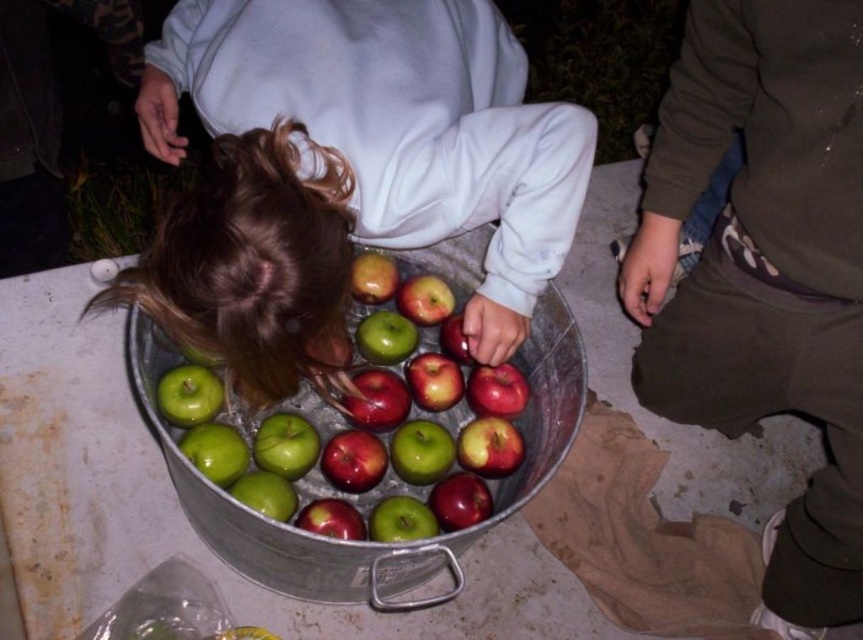
Is dark green pants at lower right bigger than green shiny apple at center?

Indeed, dark green pants at lower right has a larger size compared to green shiny apple at center.

In the scene shown: Who is positioned more to the right, dark green pants at lower right or green shiny apple at center?

dark green pants at lower right

Is point (799, 356) farther from camera compared to point (338, 428)?

No.

The width and height of the screenshot is (863, 640). I want to click on dark green pants at lower right, so click(765, 272).

Between smooth green apples at center and dark green pants at lower right, which one is positioned higher?

smooth green apples at center

Does point (494, 138) lie behind point (772, 365)?

No, (494, 138) is in front of (772, 365).

In order to click on smooth green apples at center in this screenshot , I will do `click(345, 170)`.

Is point (526, 106) closer to camera compared to point (394, 358)?

Yes, point (526, 106) is in front of point (394, 358).

Image resolution: width=863 pixels, height=640 pixels. I want to click on smooth green apples at center, so click(345, 170).

Identify the location of smooth green apples at center. (345, 170).